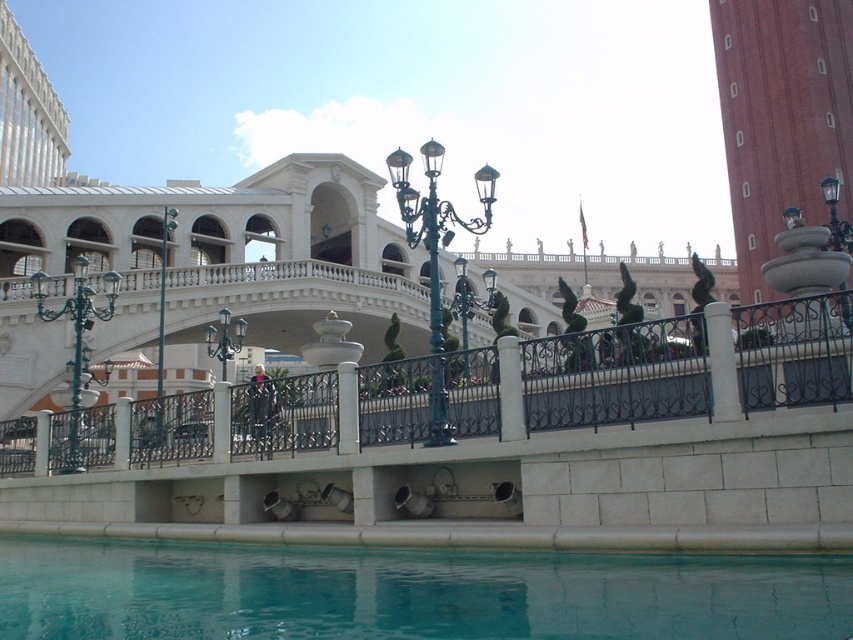
Who is more forward, [578,596] or [78,362]?

Point [578,596]

Is teal glossy water at lower center shorter than green metal lamp post at left?

Yes.

Is point (67, 560) farther from viewer compared to point (109, 317)?

No.

This screenshot has width=853, height=640. I want to click on teal glossy water at lower center, so click(x=409, y=593).

What are the coordinates of `polished brass streetlight at center` in the screenshot? It's located at (469, 298).

Between polished brass streetlight at center and black metal lamp post at upper right, which one has less height?

Standing shorter between the two is polished brass streetlight at center.

This screenshot has width=853, height=640. I want to click on polished brass streetlight at center, so click(x=469, y=298).

From the picture: Is green wrought iron streetlight at center thinner than polished brass streetlight at center?

Yes, green wrought iron streetlight at center is thinner than polished brass streetlight at center.

Who is taller, green wrought iron streetlight at center or polished brass streetlight at center?

Standing taller between the two is green wrought iron streetlight at center.

Is point (430, 362) closer to camera compared to point (480, 308)?

Yes, point (430, 362) is in front of point (480, 308).

Where is `green wrought iron streetlight at center`? The width and height of the screenshot is (853, 640). green wrought iron streetlight at center is located at coordinates (436, 256).